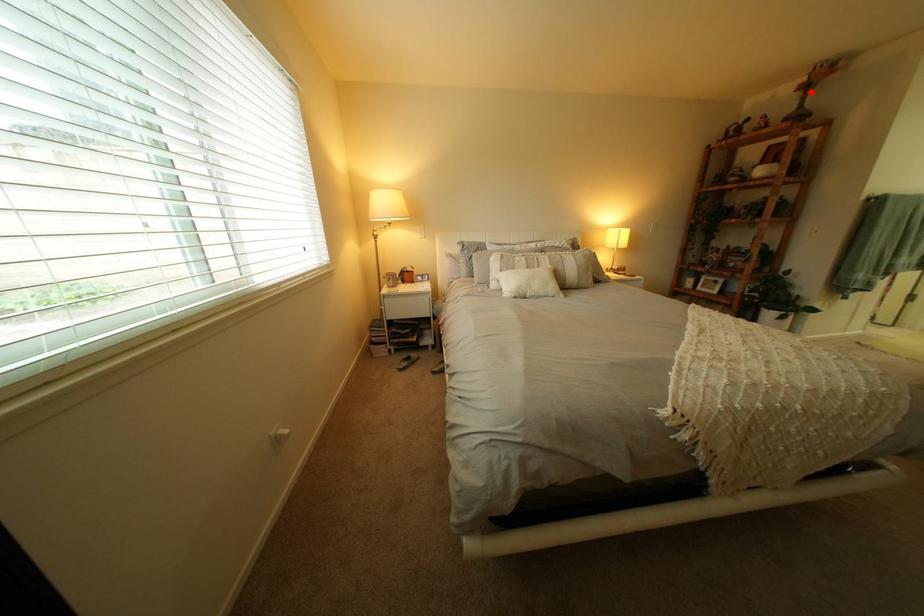
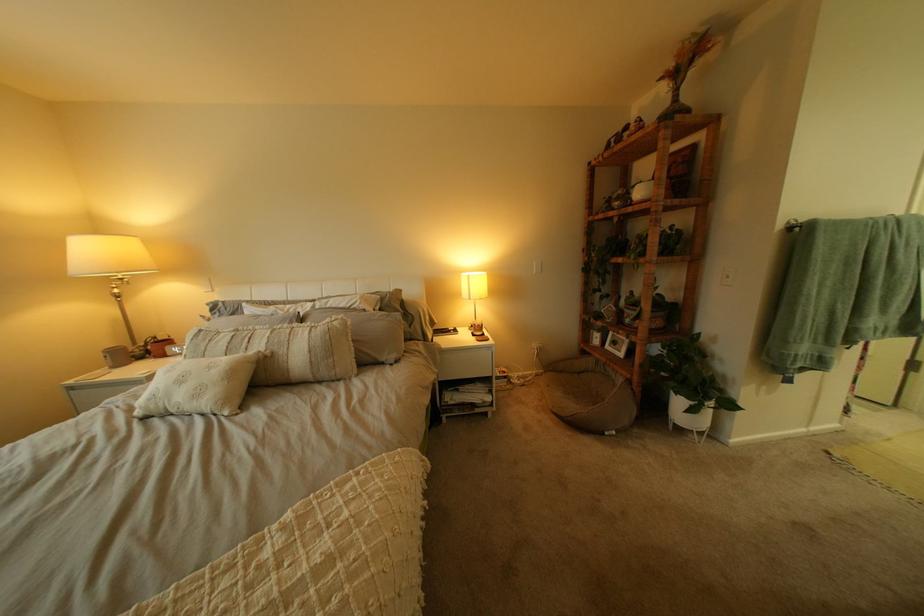
Locate, in the second image, the point that corresponds to the highlighted location in the first image.

(675, 81)